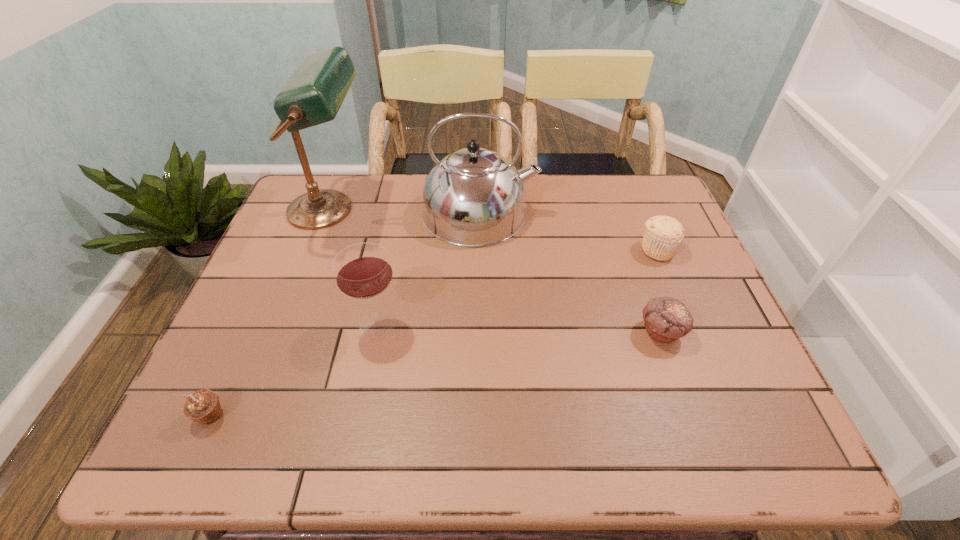
I want to click on muffin that is the closest to the farthest muffin, so click(666, 319).

Identify the location of the second closest muffin to the fifth shortest object. (666, 319).

The image size is (960, 540). Identify the location of free spot that satisfies the following two spatial constraints: 1. above the green lampshade of the tallest object; 2. on the back side of the farthest muffin. (314, 249).

Find the location of a particular element. This screenshot has width=960, height=540. free spot that satisfies the following two spatial constraints: 1. on the back side of the second nearest muffin; 2. from the spout of the kettle is located at coordinates (618, 212).

Where is `vacant area in the image that satisfies the following two spatial constraints: 1. above the green lampshade of the tallest object; 2. on the front side of the nearest object`? vacant area in the image that satisfies the following two spatial constraints: 1. above the green lampshade of the tallest object; 2. on the front side of the nearest object is located at coordinates (251, 416).

At what (x,y) coordinates should I click in order to perform the action: click on free spot that satisfies the following two spatial constraints: 1. on the back side of the wineglass; 2. above the green lampshade of the table lamp. Please return your answer as a coordinate pair (x, y). This screenshot has height=540, width=960. Looking at the image, I should click on (401, 210).

Image resolution: width=960 pixels, height=540 pixels. In order to click on free location that satisfies the following two spatial constraints: 1. from the spout of the kettle; 2. on the right side of the farthest muffin in this screenshot , I will do `click(479, 249)`.